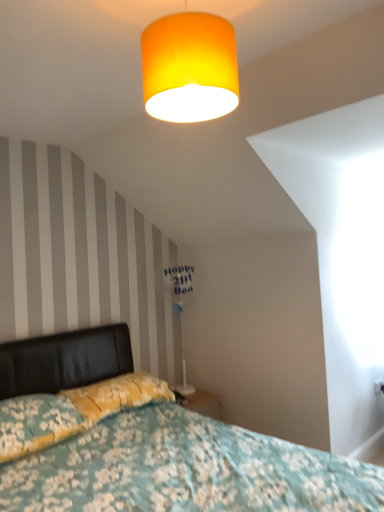
Question: Is orange fabric lampshade at upper center wider or thinner than floral fabric bed at lower left?

Choices:
 (A) thin
 (B) wide

Answer: (A)

Question: Considering the relative positions of orange fabric lampshade at upper center and floral fabric bed at lower left in the image provided, is orange fabric lampshade at upper center to the left or to the right of floral fabric bed at lower left?

Choices:
 (A) right
 (B) left

Answer: (A)

Question: Which object is positioned farthest from the floral fabric bed at lower left?

Choices:
 (A) yellow floral fabric pillow at lower left, which appears as the first pillow when viewed from the back
 (B) white plastic table lamp at center
 (C) floral fabric pillow at lower left, which is the first pillow in front-to-back order
 (D) orange fabric lampshade at upper center

Answer: (D)

Question: Which of these objects is positioned closest to the floral fabric bed at lower left?

Choices:
 (A) yellow floral fabric pillow at lower left, which ranks as the 2th pillow in front-to-back order
 (B) orange fabric lampshade at upper center
 (C) floral fabric pillow at lower left, the 2th pillow when ordered from back to front
 (D) white plastic table lamp at center

Answer: (C)